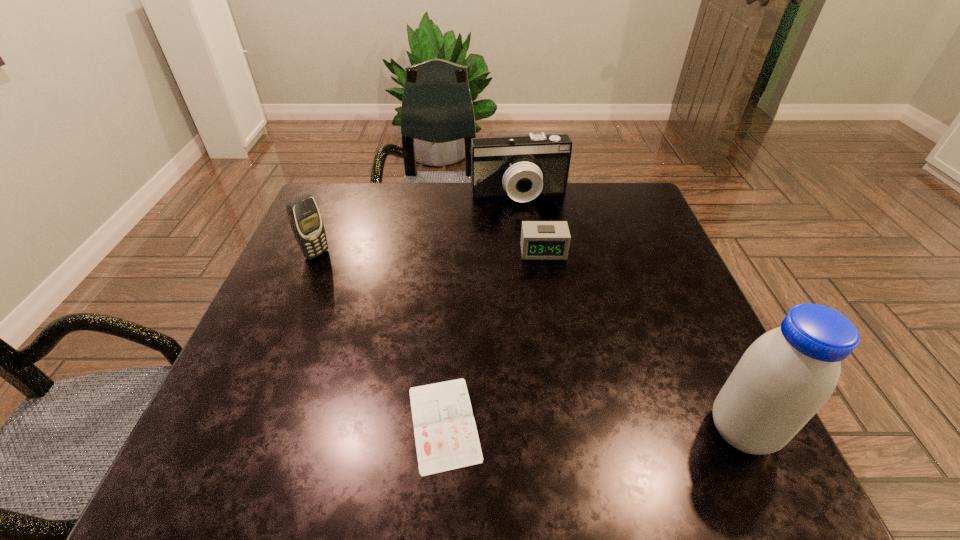
The image size is (960, 540). Find the location of `the shortest object`. the shortest object is located at coordinates (446, 437).

Image resolution: width=960 pixels, height=540 pixels. I want to click on the rightmost object, so click(x=784, y=378).

Identify the location of soya milk. Image resolution: width=960 pixels, height=540 pixels. (784, 378).

The height and width of the screenshot is (540, 960). In order to click on the fourth tallest object in this screenshot , I will do `click(540, 240)`.

Where is `the farthest object`? the farthest object is located at coordinates (x=522, y=167).

Where is `the leftmost object`? The height and width of the screenshot is (540, 960). the leftmost object is located at coordinates (305, 219).

Image resolution: width=960 pixels, height=540 pixels. Identify the location of vacant area situated on the right of the diary. (671, 423).

You are a GUI agent. You are given a task and a screenshot of the screen. Output one action in this format:
    pyautogui.click(x=<x>, y=<y>)
    Task: Click on the free region located on the back of the tallest object
    The height and width of the screenshot is (540, 960).
    Given the screenshot: What is the action you would take?
    pyautogui.click(x=717, y=377)

At what (x,y) coordinates should I click in order to perform the action: click on blank space located on the front-facing side of the fourth tallest object. Please return your answer as a coordinate pair (x, y). Looking at the image, I should click on (562, 367).

The image size is (960, 540). Find the location of `vacant space located on the front-facing side of the fourth tallest object`. vacant space located on the front-facing side of the fourth tallest object is located at coordinates (561, 358).